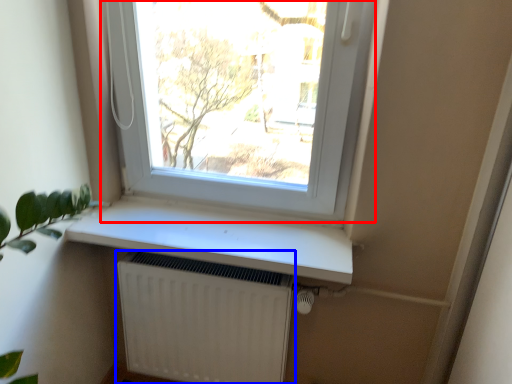
Question: Which of the following is the closest to the observer, window (highlighted by a red box) or radiator (highlighted by a blue box)?

Choices:
 (A) window
 (B) radiator

Answer: (A)